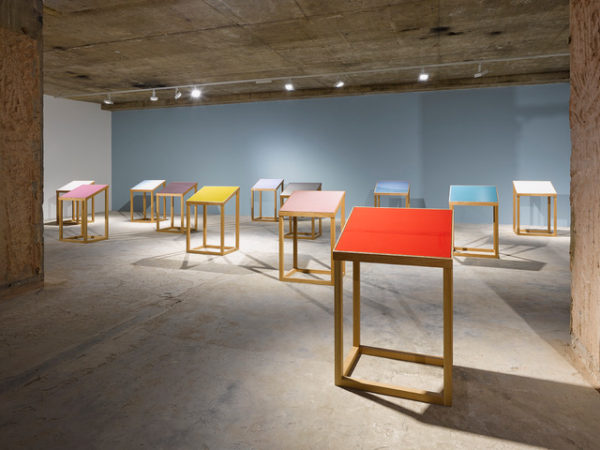
At what (x,y) coordinates should I click in order to perform the action: click on floor. Please return your answer as a coordinate pair (x, y). Looking at the image, I should click on (174, 367).